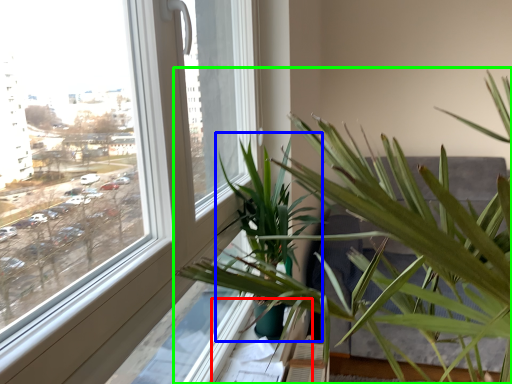
Question: Estimate the real-world distances between objects in this image. Which object is closer to window sill (highlighted by a red box), palm tree (highlighted by a blue box) or houseplant (highlighted by a green box)?

Choices:
 (A) palm tree
 (B) houseplant

Answer: (A)